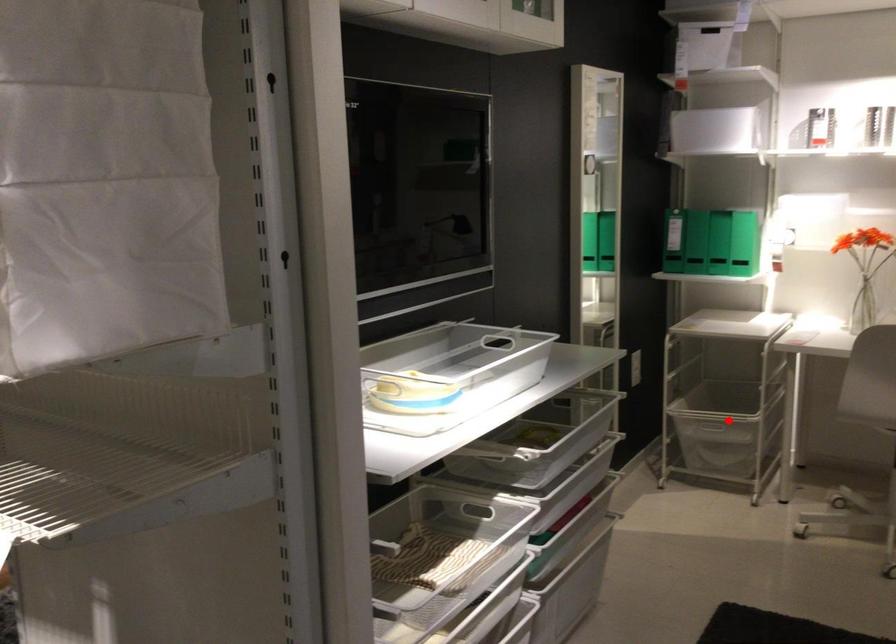
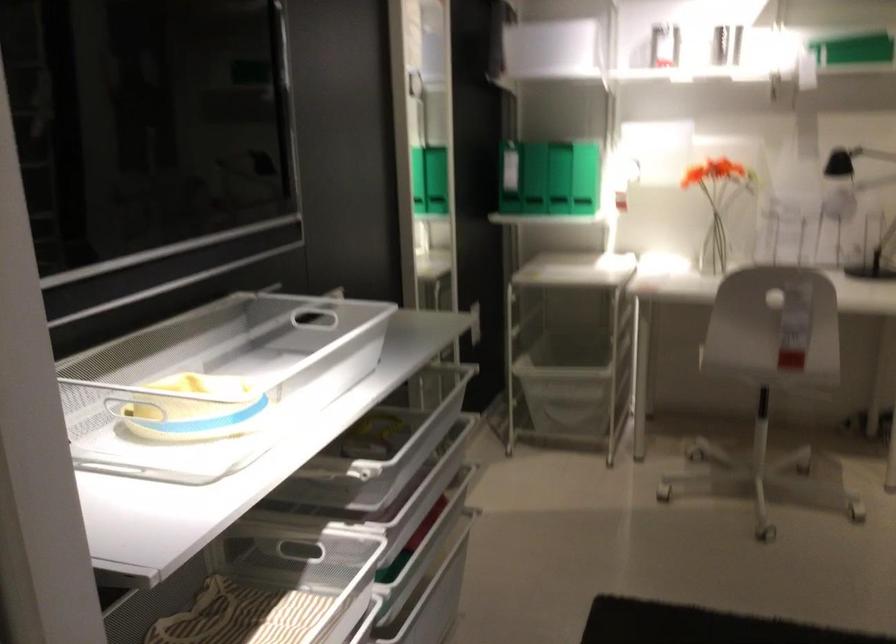
Where in the second image is the point corresponding to the highlighted location from the first image?

(566, 381)